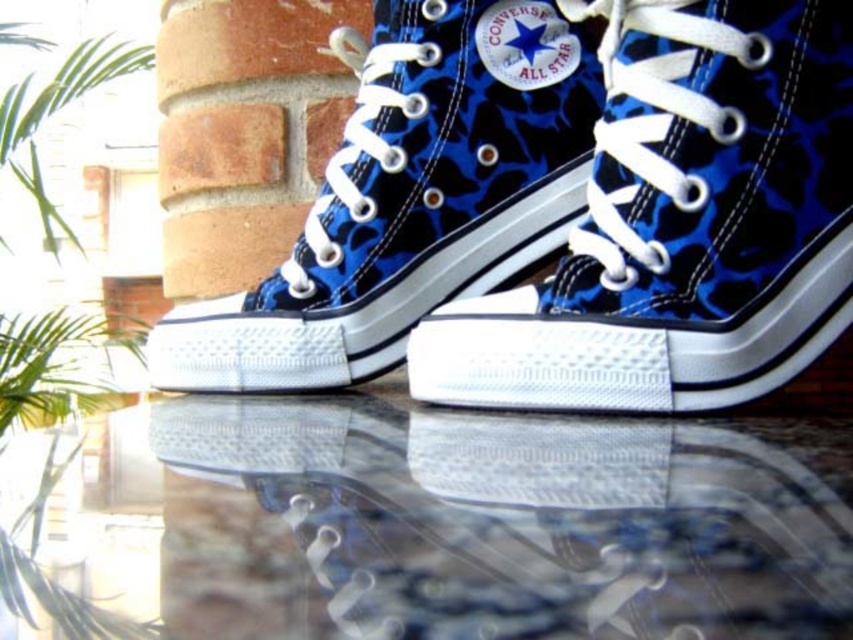
Question: Does blue camouflage fabric converse all star at center appear on the right side of green leafy plant at upper left?

Choices:
 (A) yes
 (B) no

Answer: (A)

Question: Is blue canvas converse all star at center below green leafy plant at upper left?

Choices:
 (A) yes
 (B) no

Answer: (A)

Question: Can you confirm if blue camouflage fabric converse all star at center is wider than green leafy plant at upper left?

Choices:
 (A) yes
 (B) no

Answer: (B)

Question: Which object appears closest to the camera in this image?

Choices:
 (A) transparent glass table at center
 (B) blue camouflage fabric converse all star at center

Answer: (A)

Question: Which point is closer to the camera?

Choices:
 (A) transparent glass table at center
 (B) green leafy plant at upper left
 (C) blue camouflage fabric converse all star at center
 (D) blue canvas converse all star at center

Answer: (A)

Question: Which of the following is the farthest from the observer?

Choices:
 (A) (751, 385)
 (B) (508, 618)
 (C) (12, 339)
 (D) (552, 205)

Answer: (C)